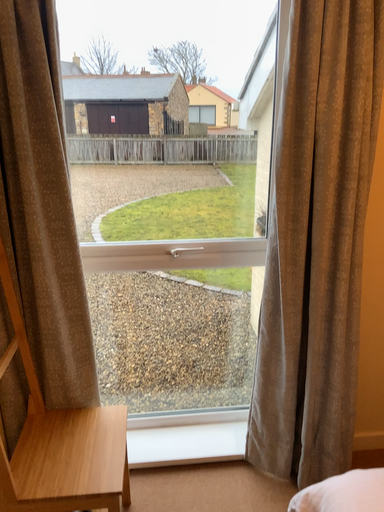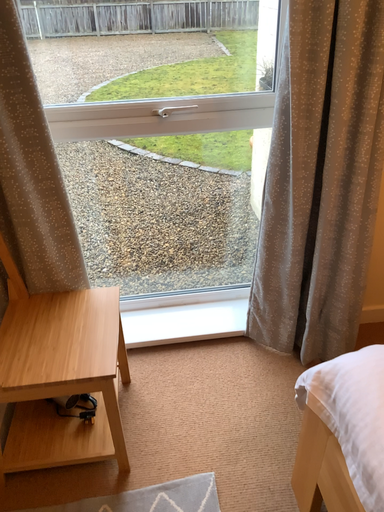
Question: Which way did the camera rotate in the video?

Choices:
 (A) rotated downward
 (B) rotated upward

Answer: (A)